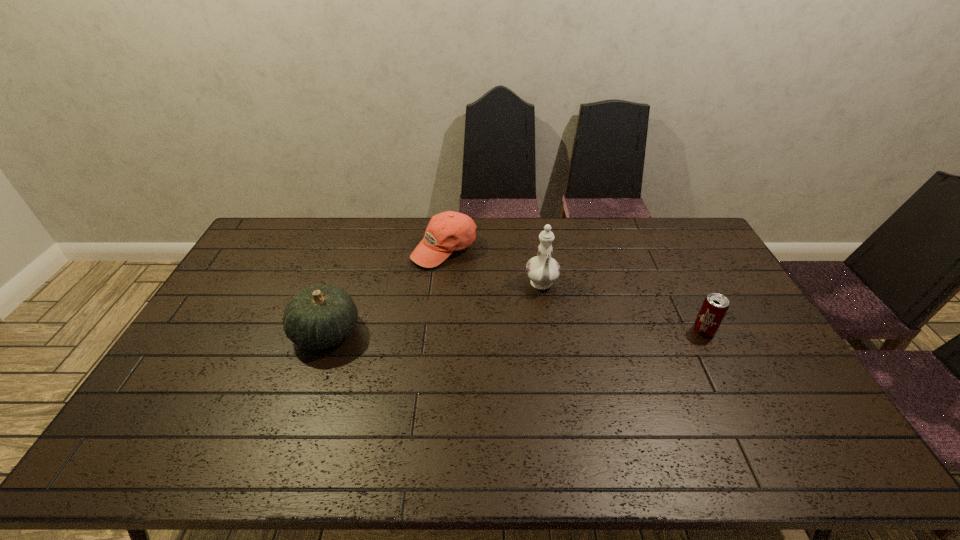
The height and width of the screenshot is (540, 960). I want to click on free space located 0.240m at the spout of the tallest object, so click(x=553, y=359).

At what (x,y) coordinates should I click in order to perform the action: click on vacant region located 0.160m at the spout of the tallest object. Please return your answer as a coordinate pair (x, y). This screenshot has height=540, width=960. Looking at the image, I should click on (549, 338).

Find the location of `free space located 0.110m on the front-facing side of the baseball cap`. free space located 0.110m on the front-facing side of the baseball cap is located at coordinates (454, 291).

You are a GUI agent. You are given a task and a screenshot of the screen. Output one action in this format:
    pyautogui.click(x=<x>, y=<y>)
    Task: Click on the vacant area situated on the front-facing side of the baseball cap
    Image resolution: width=960 pixels, height=540 pixels.
    Given the screenshot: What is the action you would take?
    pyautogui.click(x=468, y=350)

At what (x,y) coordinates should I click in order to perform the action: click on vacant space located 0.390m on the front-facing side of the baseball cap. Please return your answer as a coordinate pair (x, y). This screenshot has width=960, height=540. Looking at the image, I should click on (470, 355).

Find the location of `object that is at the far edge`. object that is at the far edge is located at coordinates (449, 231).

Where is `object that is at the right edge`? The height and width of the screenshot is (540, 960). object that is at the right edge is located at coordinates (715, 306).

Where is `vacant space at the far edge of the desktop`? The width and height of the screenshot is (960, 540). vacant space at the far edge of the desktop is located at coordinates (649, 221).

Image resolution: width=960 pixels, height=540 pixels. I want to click on vacant space at the near edge, so click(x=339, y=395).

Locate an element on the screen. free region at the left edge of the desktop is located at coordinates (232, 320).